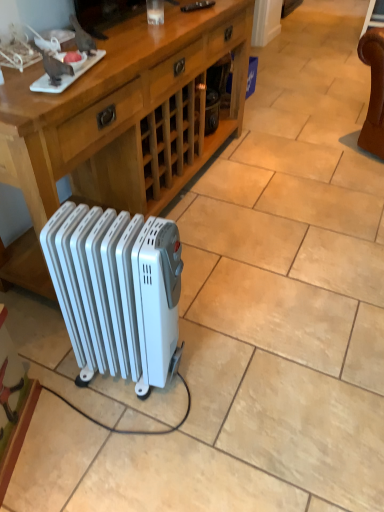
Find the location of a particular element. free spot to the left of white plastic radiator at lower center is located at coordinates (51, 383).